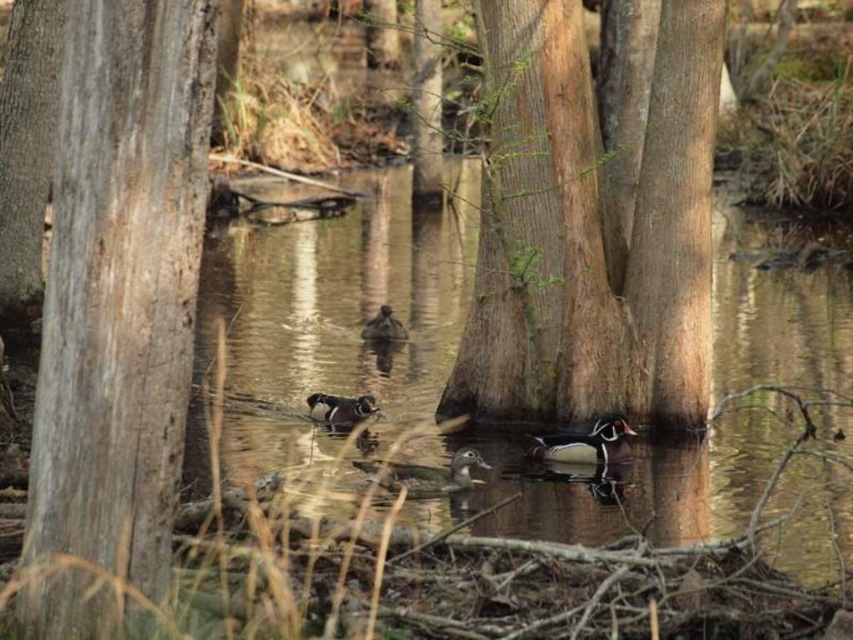
Question: Does gray textured log at left have a greater width compared to smooth brown tree trunk at center?

Choices:
 (A) no
 (B) yes

Answer: (A)

Question: Is translucent water at center behind smooth brown tree trunk at center?

Choices:
 (A) no
 (B) yes

Answer: (A)

Question: Is gray textured log at left positioned before brown speckled duck at center?

Choices:
 (A) no
 (B) yes

Answer: (B)

Question: Which point is closer to the camera taking this photo?

Choices:
 (A) (364, 416)
 (B) (724, 259)

Answer: (A)

Question: Which point is closer to the camera?

Choices:
 (A) (599, 460)
 (B) (368, 336)

Answer: (A)

Question: Estimate the real-world distances between objects in this image. Which object is closer to the brown speckled duck at center?

Choices:
 (A) shiny brown duck at center
 (B) multicolored glossy wood duck at center
 (C) translucent water at center
 (D) smooth brown tree trunk at center

Answer: (C)